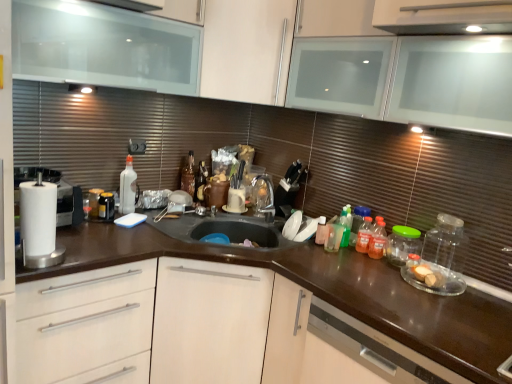
Question: Is white glossy mug at center wider or thinner than satin brown dishwasher at lower right?

Choices:
 (A) thin
 (B) wide

Answer: (A)

Question: From a real-world perspective, is white glossy mug at center physically located above or below satin brown dishwasher at lower right?

Choices:
 (A) above
 (B) below

Answer: (A)

Question: Which object is positioned closest to the white matte drawer at lower left?

Choices:
 (A) satin brown dishwasher at lower right
 (B) translucent plastic bottle at center
 (C) white glossy mug at center
 (D) brown glossy countertop at center
 (E) white matte cabinet at upper center, the 2th cabinetry when ordered from left to right

Answer: (D)

Question: Based on their relative distances, which object is farther from the white matte drawer at lower left?

Choices:
 (A) satin brown dishwasher at lower right
 (B) white matte cabinet at upper center, the 2th cabinetry when ordered from left to right
 (C) brown glossy countertop at center
 (D) transparent glass cabinet at upper left, the 2th cabinetry when ordered from right to left
 (E) translucent plastic bottle at center

Answer: (B)